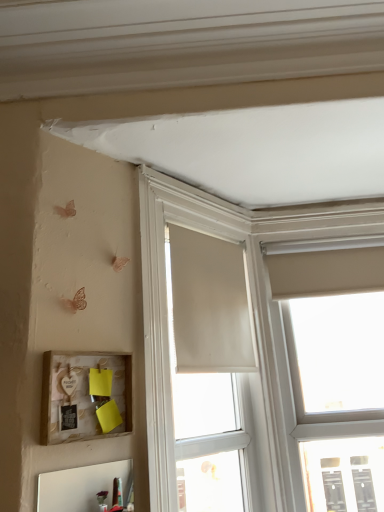
What is the approximate height of matte white window at upper right, positioned as the 1th window in right-to-left order?

matte white window at upper right, positioned as the 1th window in right-to-left order, is 4.37 feet in height.

Where is `matte white window at center, the second window when ordered from right to left`? matte white window at center, the second window when ordered from right to left is located at coordinates (252, 298).

Identify the location of wooden picture frame at lower left. The image size is (384, 512). (81, 395).

Can you confirm if beige fabric curtain at center is shorter than wooden picture frame at lower left?

In fact, beige fabric curtain at center may be taller than wooden picture frame at lower left.

Looking at their sizes, would you say beige fabric curtain at center is wider or thinner than wooden picture frame at lower left?

In the image, beige fabric curtain at center appears to be more narrow than wooden picture frame at lower left.

From a real-world perspective, is beige fabric curtain at center positioned under wooden picture frame at lower left based on gravity?

No, from a real-world perspective, beige fabric curtain at center is not under wooden picture frame at lower left.

From the picture: Is beige fabric curtain at center bigger than wooden picture frame at lower left?

Yes, beige fabric curtain at center is bigger than wooden picture frame at lower left.

Is beige fabric curtain at center oriented away from matte white window at upper right, the 2th window in the left-to-right sequence?

beige fabric curtain at center is not turned away from matte white window at upper right, the 2th window in the left-to-right sequence.

Can you confirm if beige fabric curtain at center is taller than matte white window at upper right, positioned as the 1th window in right-to-left order?

No.

From the image's perspective, does beige fabric curtain at center appear higher than matte white window at upper right, the 2th window in the left-to-right sequence?

Yes, from the image's perspective, beige fabric curtain at center is above matte white window at upper right, the 2th window in the left-to-right sequence.

Is beige fabric curtain at center completely or partially outside of matte white window at upper right, the 2th window in the left-to-right sequence?

beige fabric curtain at center is positioned outside matte white window at upper right, the 2th window in the left-to-right sequence.

Is matte white window at upper right, positioned as the 1th window in right-to-left order, facing towards matte white window at center, which ranks as the 1th window in left-to-right order?

No, matte white window at upper right, positioned as the 1th window in right-to-left order, is not aimed at matte white window at center, which ranks as the 1th window in left-to-right order.

Does matte white window at upper right, the 2th window in the left-to-right sequence, lie in front of matte white window at center, which ranks as the 1th window in left-to-right order?

No, matte white window at upper right, the 2th window in the left-to-right sequence, is further to the viewer.

From the picture: Considering the positions of objects matte white window at upper right, positioned as the 1th window in right-to-left order, and matte white window at center, which ranks as the 1th window in left-to-right order, in the image provided, who is more to the right, matte white window at upper right, positioned as the 1th window in right-to-left order, or matte white window at center, which ranks as the 1th window in left-to-right order,?

Positioned to the right is matte white window at upper right, positioned as the 1th window in right-to-left order.

From their relative heights in the image, would you say matte white window at upper right, the 2th window in the left-to-right sequence, is taller or shorter than matte white window at center, the second window when ordered from right to left?

In the image, matte white window at upper right, the 2th window in the left-to-right sequence, appears to be taller than matte white window at center, the second window when ordered from right to left.

Consider the image. Between matte white window at center, the second window when ordered from right to left, and wooden picture frame at lower left, which one has larger width?

With larger width is matte white window at center, the second window when ordered from right to left.

Locate an element on the screen. window above the wooden picture frame at lower left (from the image's perspective) is located at coordinates (252, 298).

Can wooden picture frame at lower left be found inside matte white window at center, the second window when ordered from right to left?

No, wooden picture frame at lower left is not a part of matte white window at center, the second window when ordered from right to left.

Between point (374, 206) and point (78, 417), which one is positioned in front?

Point (78, 417)

Is matte white window at upper right, the 2th window in the left-to-right sequence, completely or partially outside of beige fabric curtain at center?

Yes.

Looking at this image, considering the relative sizes of matte white window at upper right, positioned as the 1th window in right-to-left order, and beige fabric curtain at center in the image provided, is matte white window at upper right, positioned as the 1th window in right-to-left order, wider than beige fabric curtain at center?

Yes.

Which is closer, (361,310) or (212,367)?

Point (361,310).

Can you confirm if matte white window at upper right, the 2th window in the left-to-right sequence, is shorter than beige fabric curtain at center?

In fact, matte white window at upper right, the 2th window in the left-to-right sequence, may be taller than beige fabric curtain at center.

Which object is positioned more to the left, beige fabric curtain at center or matte white window at center, the second window when ordered from right to left?

Positioned to the left is matte white window at center, the second window when ordered from right to left.

Can you confirm if beige fabric curtain at center is smaller than matte white window at center, which ranks as the 1th window in left-to-right order?

Yes, beige fabric curtain at center is smaller than matte white window at center, which ranks as the 1th window in left-to-right order.

From the image's perspective, which object appears higher, beige fabric curtain at center or matte white window at center, the second window when ordered from right to left?

From the image's view, beige fabric curtain at center is above.

Does beige fabric curtain at center have a lesser height compared to matte white window at center, which ranks as the 1th window in left-to-right order?

Correct, beige fabric curtain at center is not as tall as matte white window at center, which ranks as the 1th window in left-to-right order.

Can we say matte white window at center, which ranks as the 1th window in left-to-right order, lies outside beige fabric curtain at center?

Absolutely, matte white window at center, which ranks as the 1th window in left-to-right order, is external to beige fabric curtain at center.

From the picture: Can you confirm if matte white window at center, the second window when ordered from right to left, is smaller than beige fabric curtain at center?

No, matte white window at center, the second window when ordered from right to left, is not smaller than beige fabric curtain at center.

From a real-world perspective, between matte white window at center, the second window when ordered from right to left, and beige fabric curtain at center, who is vertically higher?

In real-world perspective, beige fabric curtain at center is above.

Find the location of a particular element. curtain above the wooden picture frame at lower left (from a real-world perspective) is located at coordinates (210, 304).

From a real-world perspective, which window is the 2nd one underneath the beige fabric curtain at center? Please provide its 2D coordinates.

[(331, 371)]

Which object lies nearer to the anchor point matte white window at center, the second window when ordered from right to left, beige fabric curtain at center or wooden picture frame at lower left?

Based on the image, beige fabric curtain at center appears to be nearer to matte white window at center, the second window when ordered from right to left.

From the image, which object appears to be nearer to beige fabric curtain at center, matte white window at center, which ranks as the 1th window in left-to-right order, or wooden picture frame at lower left?

Among the two, matte white window at center, which ranks as the 1th window in left-to-right order, is located nearer to beige fabric curtain at center.

From the image, which object appears to be farther from matte white window at center, which ranks as the 1th window in left-to-right order, wooden picture frame at lower left or beige fabric curtain at center?

Based on the image, wooden picture frame at lower left appears to be further to matte white window at center, which ranks as the 1th window in left-to-right order.

Considering their positions, is beige fabric curtain at center positioned closer to matte white window at center, the second window when ordered from right to left, than matte white window at upper right, the 2th window in the left-to-right sequence?

Among the two, beige fabric curtain at center is located nearer to matte white window at center, the second window when ordered from right to left.

Estimate the real-world distances between objects in this image. Which object is closer to beige fabric curtain at center, matte white window at center, which ranks as the 1th window in left-to-right order, or matte white window at upper right, the 2th window in the left-to-right sequence?

matte white window at center, which ranks as the 1th window in left-to-right order, is positioned closer to the anchor beige fabric curtain at center.

Looking at this image, from the image, which object appears to be farther from beige fabric curtain at center, wooden picture frame at lower left or matte white window at center, the second window when ordered from right to left?

wooden picture frame at lower left is positioned further to the anchor beige fabric curtain at center.

Estimate the real-world distances between objects in this image. Which object is further from beige fabric curtain at center, matte white window at upper right, positioned as the 1th window in right-to-left order, or wooden picture frame at lower left?

wooden picture frame at lower left lies further to beige fabric curtain at center than the other object.

When comparing their distances from wooden picture frame at lower left, does matte white window at center, the second window when ordered from right to left, or beige fabric curtain at center seem closer?

Answer: Based on the image, matte white window at center, the second window when ordered from right to left, appears to be nearer to wooden picture frame at lower left.

At what (x,y) coordinates should I click in order to perform the action: click on curtain between wooden picture frame at lower left and matte white window at upper right, the 2th window in the left-to-right sequence, in the horizontal direction. Please return your answer as a coordinate pair (x, y). Looking at the image, I should click on (210, 304).

The width and height of the screenshot is (384, 512). In order to click on window between wooden picture frame at lower left and matte white window at upper right, the 2th window in the left-to-right sequence, from left to right in this screenshot , I will do `click(252, 298)`.

This screenshot has height=512, width=384. Find the location of `curtain between matte white window at center, the second window when ordered from right to left, and matte white window at upper right, the 2th window in the left-to-right sequence, from left to right`. curtain between matte white window at center, the second window when ordered from right to left, and matte white window at upper right, the 2th window in the left-to-right sequence, from left to right is located at coordinates (210, 304).

Locate an element on the screen. This screenshot has width=384, height=512. window between wooden picture frame at lower left and beige fabric curtain at center in the front-back direction is located at coordinates (252, 298).